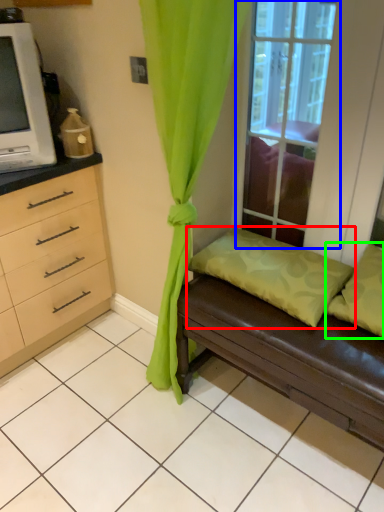
Question: Considering the real-world distances, which object is farthest from pillow (highlighted by a red box)? window (highlighted by a blue box) or pillow (highlighted by a green box)?

Choices:
 (A) window
 (B) pillow

Answer: (A)